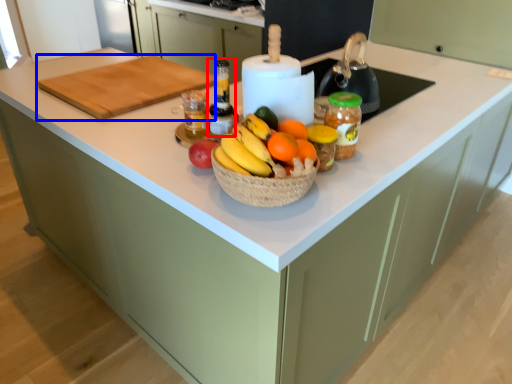
Question: Which of the following is the closest to the observer, bottle (highlighted by a red box) or cutting board (highlighted by a blue box)?

Choices:
 (A) bottle
 (B) cutting board

Answer: (A)